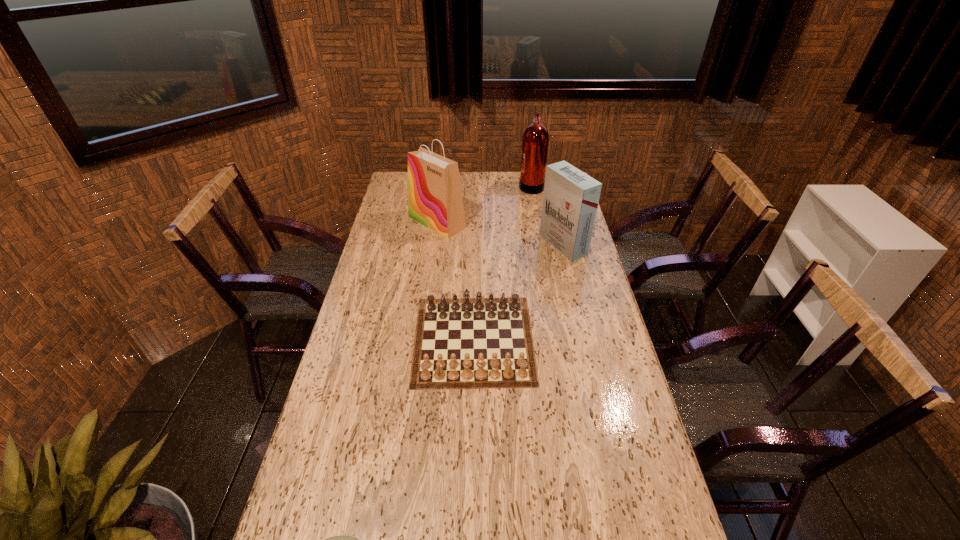
Where is `object at the far edge`? object at the far edge is located at coordinates (535, 141).

At what (x,y) coordinates should I click in order to perform the action: click on object at the left edge. Please return your answer as a coordinate pair (x, y). The image size is (960, 540). Looking at the image, I should click on (435, 200).

What are the coordinates of `fire extinguisher that is at the right edge` in the screenshot? It's located at (535, 141).

Identify the location of cigarette case that is at the right edge. (570, 200).

Locate an element on the screen. This screenshot has width=960, height=540. object at the far right corner is located at coordinates (535, 141).

Locate an element on the screen. The width and height of the screenshot is (960, 540). vacant area at the left edge of the desktop is located at coordinates (406, 269).

The height and width of the screenshot is (540, 960). Find the location of `free point at the right edge`. free point at the right edge is located at coordinates point(621,397).

Locate an element on the screen. vacant space at the far left corner is located at coordinates (392, 186).

In order to click on free space between the third shortest object and the shopping bag in this screenshot , I will do `click(500, 233)`.

Where is `blank region between the second nearest object and the cigarette case`? blank region between the second nearest object and the cigarette case is located at coordinates (518, 292).